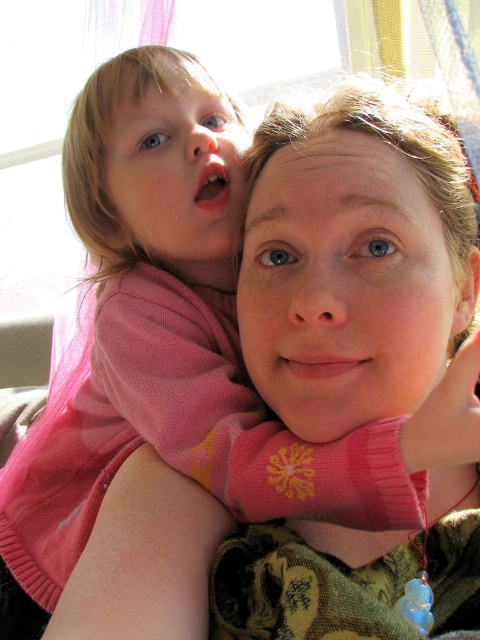
Question: Does smooth skin face at center appear on the left side of matte pink sweater at upper left?

Choices:
 (A) no
 (B) yes

Answer: (A)

Question: Which object appears farthest from the camera in this image?

Choices:
 (A) smooth skin face at center
 (B) matte pink sweater at upper left

Answer: (B)

Question: Is smooth skin face at center to the right of matte pink sweater at upper left from the viewer's perspective?

Choices:
 (A) yes
 (B) no

Answer: (A)

Question: Which point is farther from the camera taking this photo?

Choices:
 (A) (204, 170)
 (B) (267, 291)

Answer: (A)

Question: Where is smooth skin face at center located in relation to matte pink sweater at upper left in the image?

Choices:
 (A) right
 (B) left

Answer: (A)

Question: Among these objects, which one is farthest from the camera?

Choices:
 (A) smooth skin face at center
 (B) matte pink sweater at upper left

Answer: (B)